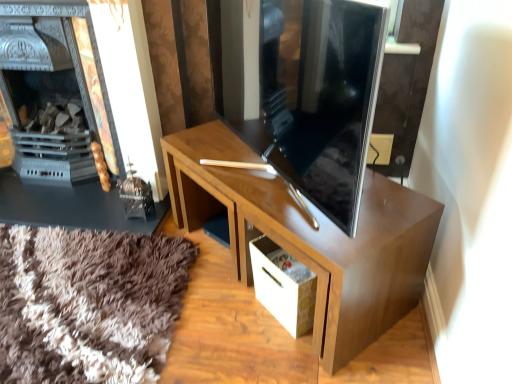
Question: Is glossy wood desk at center positioned beyond the bounds of white cardboard drawer at lower center?

Choices:
 (A) no
 (B) yes

Answer: (B)

Question: Is glossy wood desk at center taller than white cardboard drawer at lower center?

Choices:
 (A) no
 (B) yes

Answer: (B)

Question: Does glossy wood desk at center have a lesser height compared to white cardboard drawer at lower center?

Choices:
 (A) no
 (B) yes

Answer: (A)

Question: Could you tell me if glossy wood desk at center is turned towards white cardboard drawer at lower center?

Choices:
 (A) no
 (B) yes

Answer: (B)

Question: From a real-world perspective, is glossy wood desk at center positioned under white cardboard drawer at lower center based on gravity?

Choices:
 (A) no
 (B) yes

Answer: (A)

Question: Can you see glossy wood desk at center touching white cardboard drawer at lower center?

Choices:
 (A) no
 (B) yes

Answer: (A)

Question: From a real-world perspective, is glossy wood desk at center below matte black fireplace at left?

Choices:
 (A) no
 (B) yes

Answer: (B)

Question: Is glossy wood desk at center positioned far away from matte black fireplace at left?

Choices:
 (A) yes
 (B) no

Answer: (B)

Question: Does glossy wood desk at center come behind matte black fireplace at left?

Choices:
 (A) yes
 (B) no

Answer: (B)

Question: From the image's perspective, would you say glossy wood desk at center is shown under matte black fireplace at left?

Choices:
 (A) yes
 (B) no

Answer: (A)

Question: Is glossy wood desk at center next to matte black fireplace at left and touching it?

Choices:
 (A) no
 (B) yes

Answer: (A)

Question: Does glossy wood desk at center turn towards matte black fireplace at left?

Choices:
 (A) yes
 (B) no

Answer: (B)

Question: Could white cardboard drawer at lower center be considered to be inside matte black fireplace at left?

Choices:
 (A) yes
 (B) no

Answer: (B)